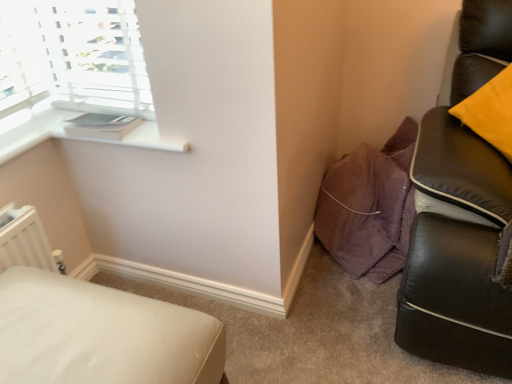
Question: Do you think white matte window sill at upper left is within white fabric ottoman at lower left, or outside of it?

Choices:
 (A) inside
 (B) outside

Answer: (B)

Question: Is white matte window sill at upper left wider or thinner than white fabric ottoman at lower left?

Choices:
 (A) thin
 (B) wide

Answer: (A)

Question: From their relative heights in the image, would you say white matte window sill at upper left is taller or shorter than white fabric ottoman at lower left?

Choices:
 (A) short
 (B) tall

Answer: (A)

Question: Is white fabric ottoman at lower left to the left or to the right of white matte window sill at upper left in the image?

Choices:
 (A) right
 (B) left

Answer: (B)

Question: From a real-world perspective, is white fabric ottoman at lower left above or below white matte window sill at upper left?

Choices:
 (A) above
 (B) below

Answer: (B)

Question: Is white fabric ottoman at lower left inside the boundaries of white matte window sill at upper left, or outside?

Choices:
 (A) outside
 (B) inside

Answer: (A)

Question: Is white fabric ottoman at lower left bigger or smaller than white matte window sill at upper left?

Choices:
 (A) small
 (B) big

Answer: (B)